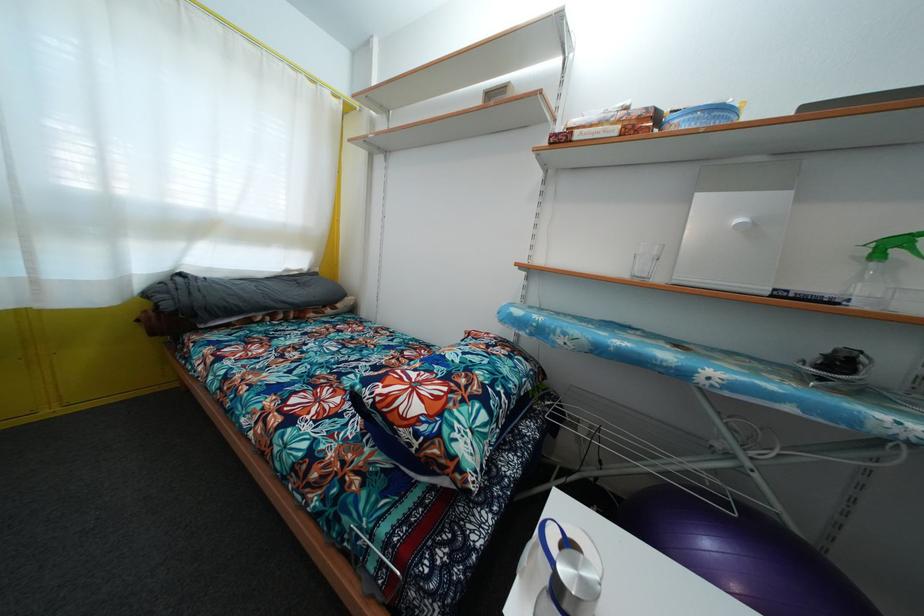
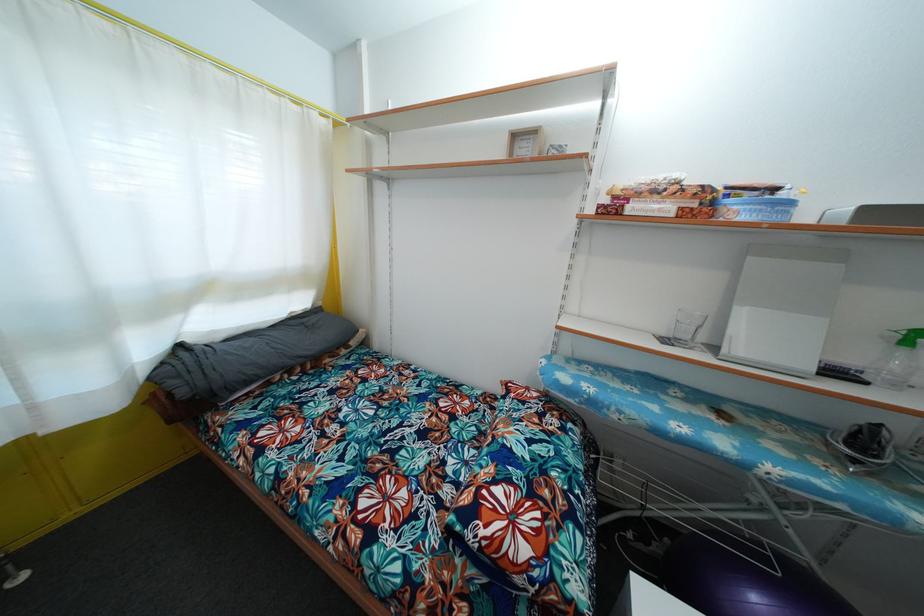
Question: I am providing you with two images of the same scene from different viewpoints. Please identify which objects are invisible in image2.

Choices:
 (A) clear drinking glass
 (B) grey pillow
 (C) purple exercise ball
 (D) none of these

Answer: (D)